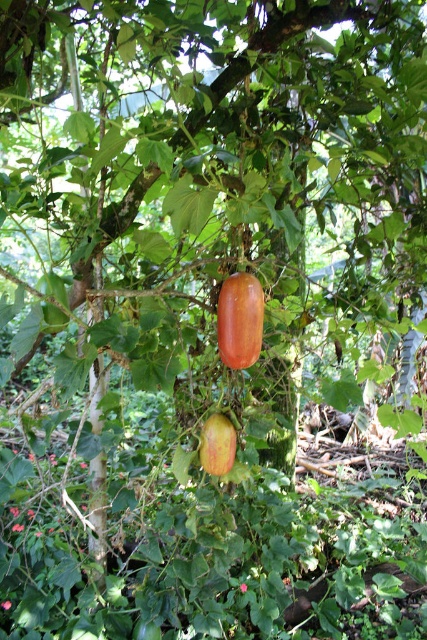
You are a gardener who wants to harvest both the shiny orange squash at center and the green matte apple at center. If your basket can only hold one fruit at a time, and you need to walk back and forth between them to collect both, how many total inches will you walk?

The distance between the shiny orange squash at center and the green matte apple at center is 12.29 inches. To collect both fruits, you would walk 12.29 inches to get the first fruit, return 12.29 inches to the starting point, and then walk another 12.29 inches to collect the second fruit. Total distance walked is 12.29 x 3 equals 36.87 inches.

You are an apple picker who needs to reach both the shiny orange squash at center and the green matte apple at center. Which one do you need to look up to pick?

The shiny orange squash at center is above the green matte apple at center, so you need to look up to pick the shiny orange squash at center.